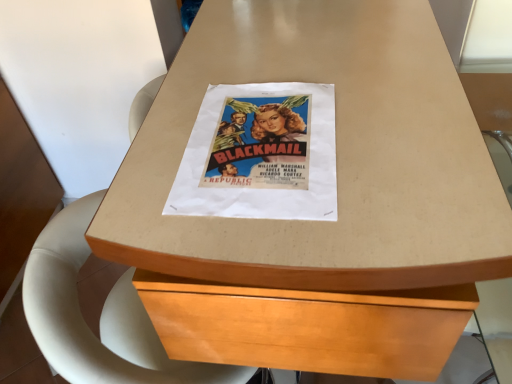
Image resolution: width=512 pixels, height=384 pixels. Describe the element at coordinates (100, 316) in the screenshot. I see `white leather swivel chair at center` at that location.

Where is `white leather swivel chair at center`? This screenshot has width=512, height=384. white leather swivel chair at center is located at coordinates click(x=100, y=316).

Identify the location of white leather swivel chair at center. This screenshot has width=512, height=384. (100, 316).